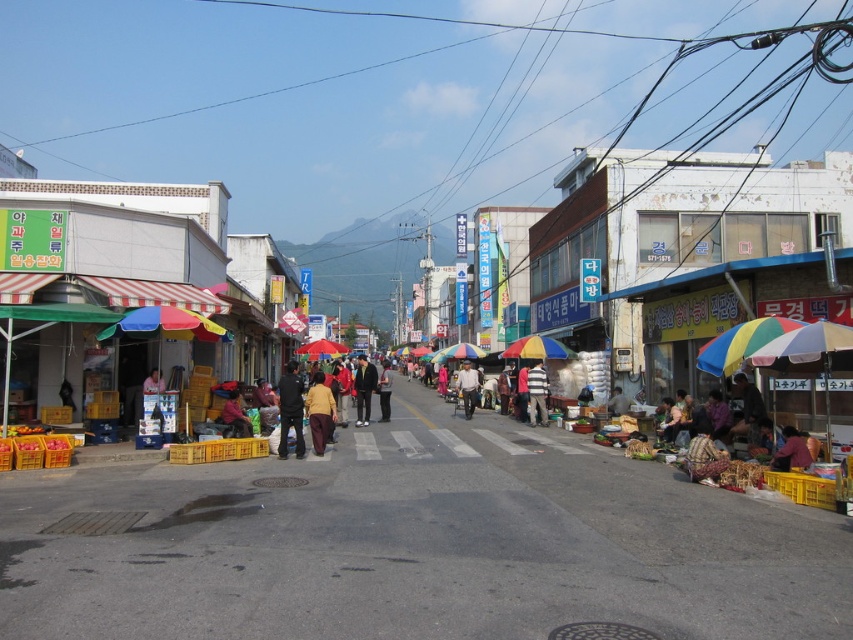
Is point (329, 401) positioned in front of point (445, 356)?

Yes, point (329, 401) is closer to viewer.

Between yellow fabric pants at center and rainbow striped umbrella at center, which one appears on the left side from the viewer's perspective?

yellow fabric pants at center

This screenshot has width=853, height=640. Find the location of `yellow fabric pants at center`. yellow fabric pants at center is located at coordinates (320, 412).

Can you confirm if dark gray pants at center is positioned to the left of multicolored fabric umbrella at center?

Incorrect, dark gray pants at center is not on the left side of multicolored fabric umbrella at center.

Between dark gray pants at center and multicolored fabric umbrella at center, which one is positioned lower?

dark gray pants at center is lower down.

Does point (364, 420) lie behind point (306, 358)?

No, it is not.

At what (x,y) coordinates should I click in order to perform the action: click on dark gray pants at center. Please return your answer as a coordinate pair (x, y). The image size is (853, 640). Looking at the image, I should click on (364, 388).

Is dark blue jeans at center above rainbow striped umbrella at center?

Actually, dark blue jeans at center is below rainbow striped umbrella at center.

Is dark blue jeans at center thinner than rainbow striped umbrella at center?

No.

At what (x,y) coordinates should I click in order to perform the action: click on dark blue jeans at center. Please return your answer as a coordinate pair (x, y). The image size is (853, 640). Looking at the image, I should click on (289, 410).

Find the location of a particular element. dark blue jeans at center is located at coordinates (289, 410).